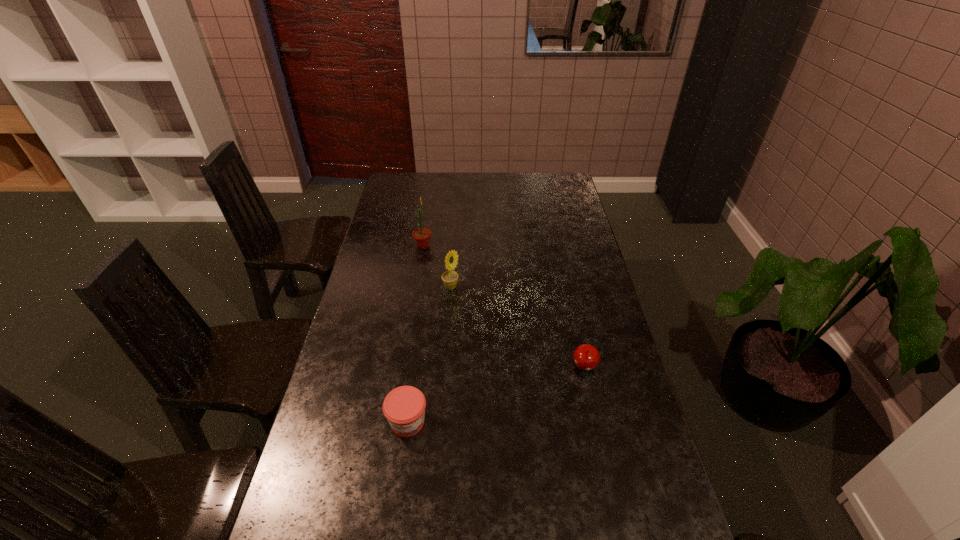
This screenshot has width=960, height=540. Identify the location of free space between the rightmost object and the farther sunflower. (504, 307).

Locate an element on the screen. The height and width of the screenshot is (540, 960). free space between the third object from left to right and the left sunflower is located at coordinates (437, 267).

You are a GUI agent. You are given a task and a screenshot of the screen. Output one action in this format:
    pyautogui.click(x=<x>, y=<y>)
    Task: Click on the free space between the farther sunflower and the shorter sunflower
    Image resolution: width=960 pixels, height=540 pixels.
    Given the screenshot: What is the action you would take?
    pyautogui.click(x=437, y=267)

You are a GUI agent. You are given a task and a screenshot of the screen. Output one action in this format:
    pyautogui.click(x=<x>, y=<y>)
    Task: Click on the free spot between the rightmost object and the tallest object
    The image size is (960, 540).
    Given the screenshot: What is the action you would take?
    pyautogui.click(x=504, y=307)

What are the coordinates of `free space between the rightmost object and the jam` in the screenshot? It's located at (496, 395).

Where is `blank region between the shorter sunflower and the left sunflower`? Image resolution: width=960 pixels, height=540 pixels. blank region between the shorter sunflower and the left sunflower is located at coordinates (437, 267).

Locate an element on the screen. object that is the second closest one to the nearest object is located at coordinates (450, 278).

Point out which object is positioned as the nearest to the taller sunflower. Please provide its 2D coordinates. Your answer should be formatted as a tuple, i.e. [(x, y)], where the tuple contains the x and y coordinates of a point satisfying the conditions above.

[(450, 278)]

This screenshot has height=540, width=960. In order to click on free region that satisfies the following two spatial constraints: 1. on the face of the nearer sunflower; 2. on the front label of the jam in this screenshot , I will do `click(441, 422)`.

I want to click on free point that satisfies the following two spatial constraints: 1. on the face of the second farthest object; 2. on the back side of the rightmost object, so click(444, 368).